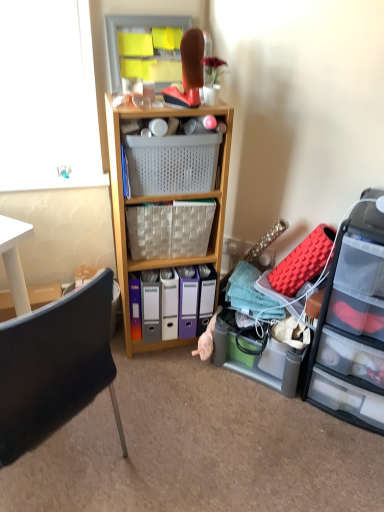
Identify the location of vacant space in black plastic chair at lower left (from a real-world perspective). Image resolution: width=384 pixels, height=512 pixels. point(61,473).